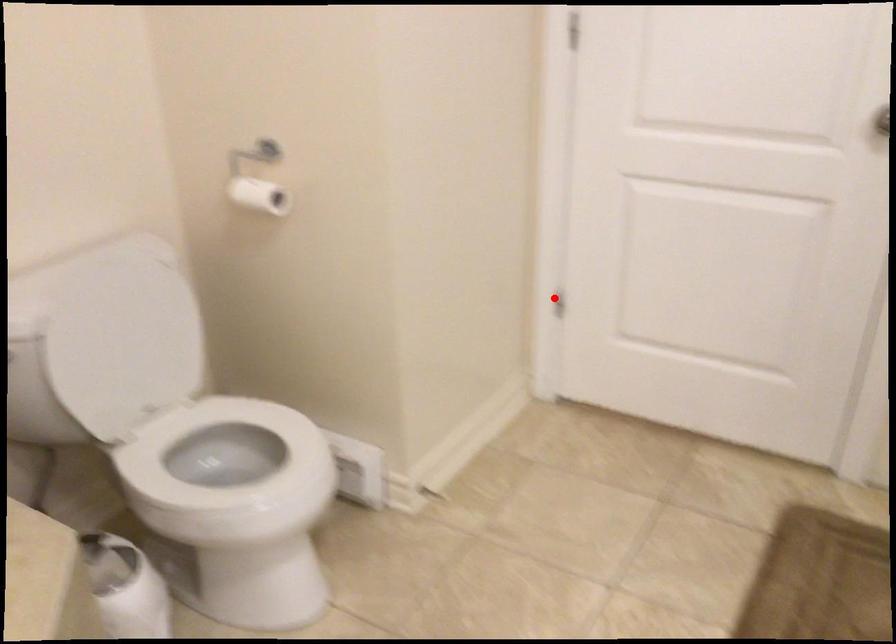
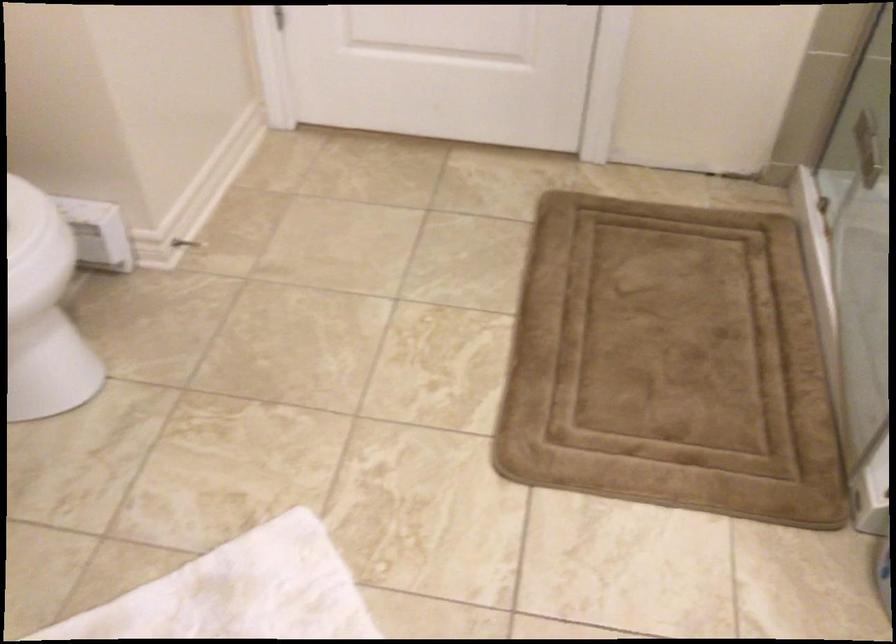
Question: I am providing you with two images of the same scene from different viewpoints. Given a red point in image1, look at the same physical point in image2. Is it:

Choices:
 (A) Closer to the viewpoint
 (B) Farther from the viewpoint

Answer: (A)